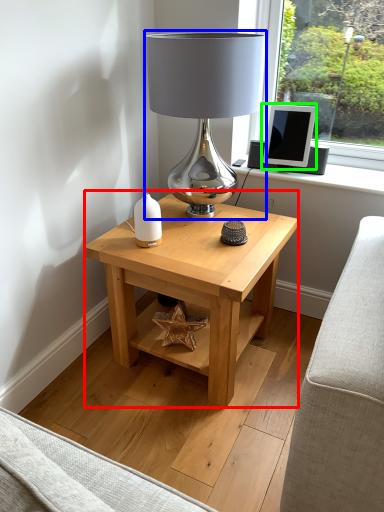
Question: Estimate the real-world distances between objects in this image. Which object is closer to table (highlighted by a red box), lamp (highlighted by a blue box) or computer monitor (highlighted by a green box)?

Choices:
 (A) lamp
 (B) computer monitor

Answer: (A)